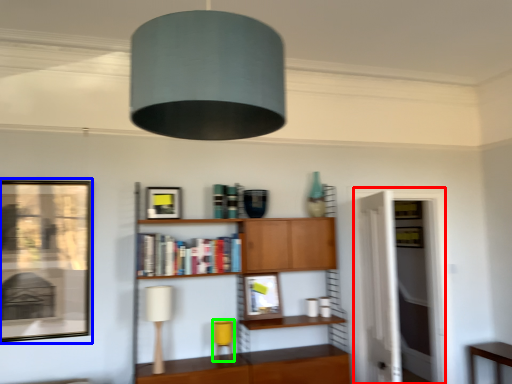
Question: Estimate the real-world distances between objects in this image. Which object is farther from glass door (highlighted by a red box), picture frame (highlighted by a blue box) or table lamp (highlighted by a green box)?

Choices:
 (A) picture frame
 (B) table lamp

Answer: (A)